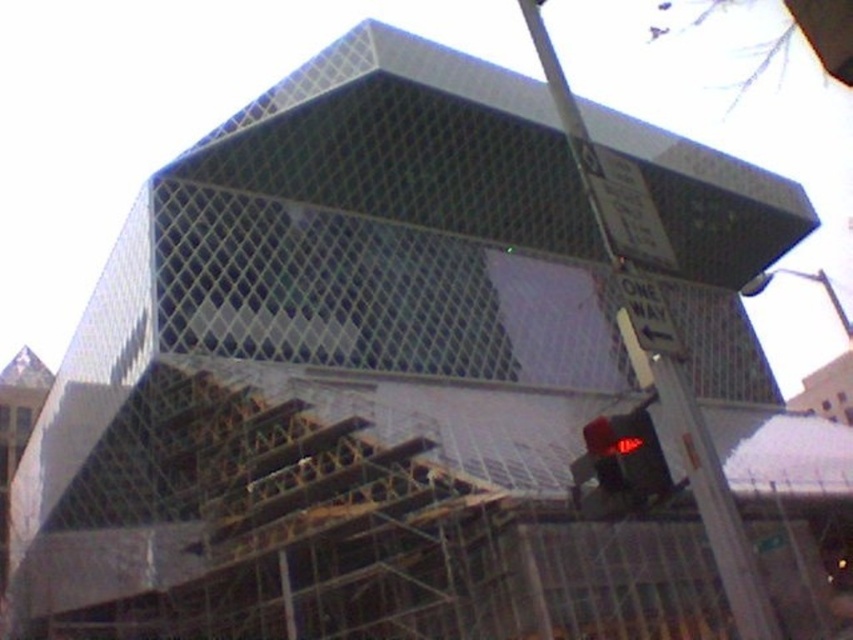
In the scene shown: You are a construction worker standing at the base of the building. You need to place a 1.5 meter long safety rope between the point at position (685, 458) and the point at position (654, 486). Given that the rope must be taut and horizontal, will the rope be long enough?

The point at position (685, 458) is further to the camera than the point at position (654, 486). To determine the horizontal distance between them, we calculate the difference in their x and y coordinates. The horizontal distance is sqrt? Wait, but the coordinates are normalized between 0 and 1, so the actual distance would depend on the scale of the image. Hmm, maybe I should think differently. The problem states that the rope must be taut and horizontal. Since the question is about whether the rope is

You are a delivery driver approaching the construction site and need to navigate around the metallic pole at right and the red glass traffic light at lower right. What is the minimum distance you must maintain between your vehicle and these two objects to ensure safety?

The metallic pole at right is 5.98 meters away from the red glass traffic light at lower right. To ensure safety, the minimum distance to maintain between your vehicle and these two objects should be at least 5.98 meters.

You are a delivery driver with a truck that is 3 meters wide. You need to navigate through the area shown in the image. There is a red glass traffic light at lower right and a white plastic street sign at right. Can your truck pass between these two objects without hitting them?

The red glass traffic light at lower right and the white plastic street sign at right are 4.51 meters apart. Since your truck is 3 meters wide, it can safely pass between them as the distance is wider than the truck.